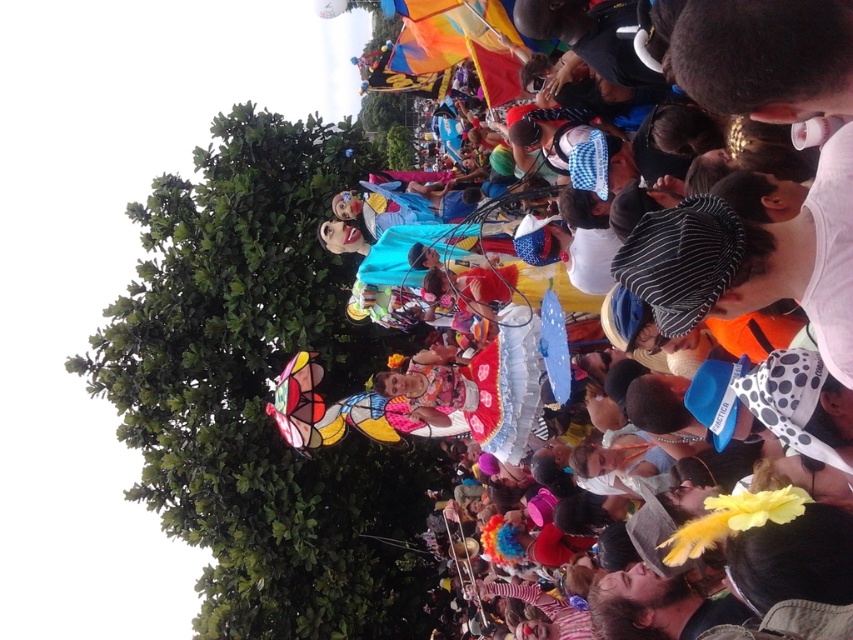
Question: Which object appears closest to the camera in this image?

Choices:
 (A) green leafy tree at upper left
 (B) matte colorful costumes at center

Answer: (B)

Question: Can you confirm if green leafy tree at upper left is positioned to the left of matte colorful costumes at center?

Choices:
 (A) no
 (B) yes

Answer: (B)

Question: Can you confirm if green leafy tree at upper left is positioned below matte colorful costumes at center?

Choices:
 (A) yes
 (B) no

Answer: (A)

Question: Can you confirm if green leafy tree at upper left is thinner than matte colorful costumes at center?

Choices:
 (A) no
 (B) yes

Answer: (A)